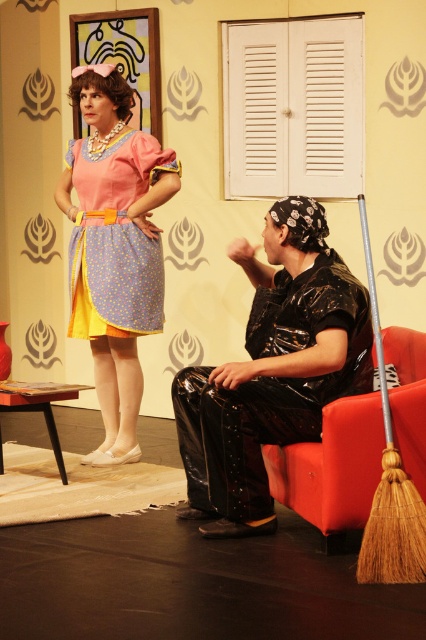
Can you confirm if shiny black pants at lower right is wider than matte pink fabric dress at upper left?

Correct, the width of shiny black pants at lower right exceeds that of matte pink fabric dress at upper left.

Does point (221, 387) come behind point (71, 157)?

No.

Does point (227, 388) come in front of point (158, 291)?

That is True.

Identify the location of shiny black pants at lower right. (273, 371).

Between matte pink fabric dress at upper left and rubberized black armchair at lower right, which one appears on the left side from the viewer's perspective?

matte pink fabric dress at upper left

Can you confirm if matte pink fabric dress at upper left is taller than rubberized black armchair at lower right?

Yes, matte pink fabric dress at upper left is taller than rubberized black armchair at lower right.

Describe the element at coordinates (115, 237) in the screenshot. This screenshot has width=426, height=640. I see `matte pink fabric dress at upper left` at that location.

Where is `matte pink fabric dress at upper left`? The height and width of the screenshot is (640, 426). matte pink fabric dress at upper left is located at coordinates coord(115,237).

Who is positioned more to the right, shiny black pants at lower right or matte pink dress at upper left?

shiny black pants at lower right

Does point (204, 477) come closer to viewer compared to point (170, 180)?

Yes, it is.

Between point (333, 342) and point (155, 248), which one is positioned behind?

The point (155, 248) is more distant.

Locate an element on the screen. The image size is (426, 640). shiny black pants at lower right is located at coordinates tap(273, 371).